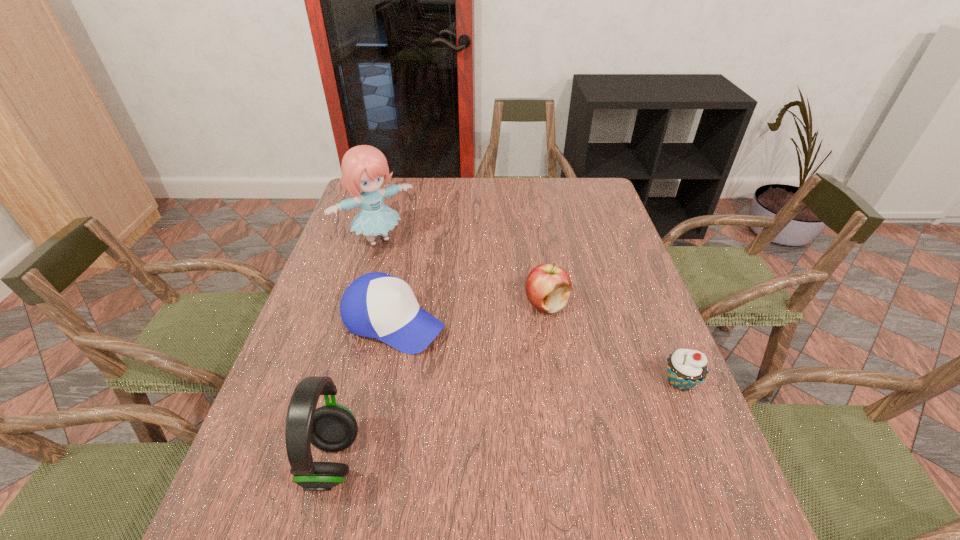
The image size is (960, 540). Find the location of `headset located in the left edge section of the desktop`. headset located in the left edge section of the desktop is located at coordinates (331, 428).

I want to click on doll present at the left edge, so click(364, 167).

The height and width of the screenshot is (540, 960). In order to click on baseball cap at the left edge in this screenshot , I will do click(x=377, y=305).

Locate an element on the screen. Image resolution: width=960 pixels, height=540 pixels. object present at the right edge is located at coordinates (686, 368).

You are a GUI agent. You are given a task and a screenshot of the screen. Output one action in this format:
    pyautogui.click(x=<x>, y=<y>)
    Task: Click on the object that is positioned at the near left corner
    This screenshot has width=960, height=540.
    Given the screenshot: What is the action you would take?
    pyautogui.click(x=331, y=428)

At what (x,y) coordinates should I click in order to perform the action: click on vacant area at the far edge of the desktop. Please return your answer as a coordinate pair (x, y). The image size is (960, 540). Looking at the image, I should click on (446, 200).

Where is `vacant space at the near edge of the desktop`? This screenshot has width=960, height=540. vacant space at the near edge of the desktop is located at coordinates (399, 486).

I want to click on vacant region at the left edge of the desktop, so click(x=288, y=380).

At what (x,y) coordinates should I click in order to perform the action: click on free space at the right edge of the desktop. Please return your answer as a coordinate pair (x, y). Image resolution: width=960 pixels, height=540 pixels. Looking at the image, I should click on (663, 335).

This screenshot has height=540, width=960. Find the location of `vacant space at the far right corner`. vacant space at the far right corner is located at coordinates (594, 185).